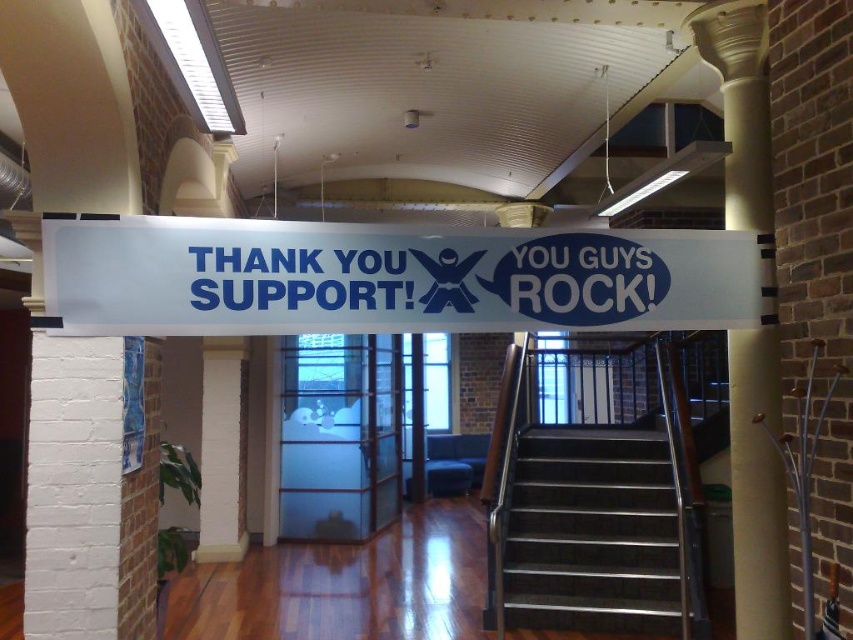
You are an event planner who needs to hang a new banner that is the same size as the white plastic banner at center. The new banner will be placed above the stainless steel stairs at center. Will the new banner fit without overlapping the stairs?

The white plastic banner at center is smaller than the stainless steel stairs at center. Since the new banner is the same size as the white plastic banner at center, it will fit above the stainless steel stairs at center without overlapping them.

You are an event organizer who needs to hang a new banner that is 36 inches wide. You see the white plastic banner at center and the white painted brick pillar at left. Can you fit the new banner between them without overlapping either object?

The white plastic banner at center and white painted brick pillar at left are 34.58 inches apart, so the new banner which is 36 inches wide cannot fit between them without overlapping since the space is narrower than the banner.